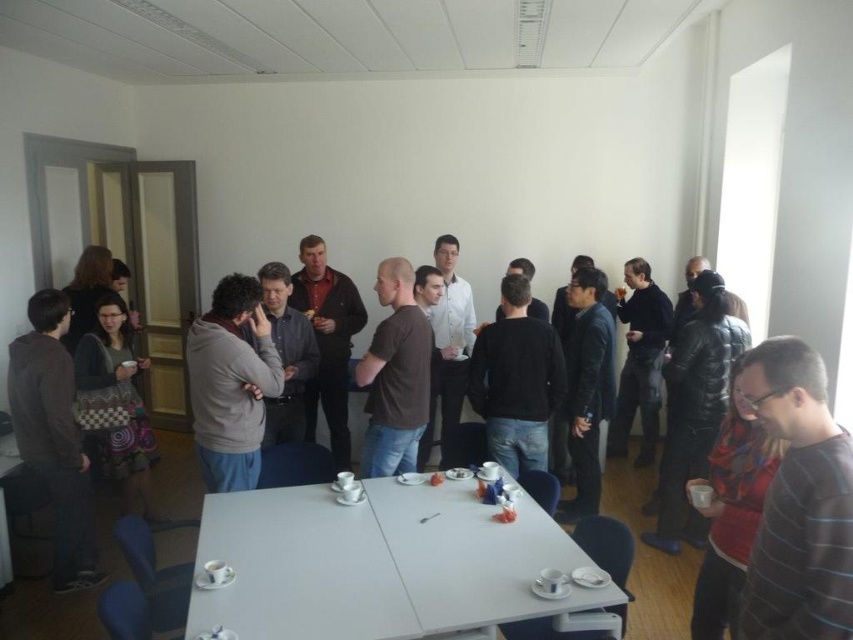
You are a photographer trying to capture a candid shot of the striped cotton shirt at lower right and the matte gray hoodie at left. Since you want to ensure both subjects are in focus, you need to know their vertical positions. Can you tell me which one is higher up in the image?

The striped cotton shirt at lower right is above the matte gray hoodie at left, so the striped cotton shirt at lower right is positioned higher in the image.

You are organizing a photo shoot and need to arrange the striped cotton shirt at lower right and the matte gray hoodie at left based on their heights. Which one should be placed first if you want to arrange them from shortest to tallest?

The striped cotton shirt at lower right is shorter than the matte gray hoodie at left, so you should place the striped cotton shirt at lower right first, followed by the matte gray hoodie at left.